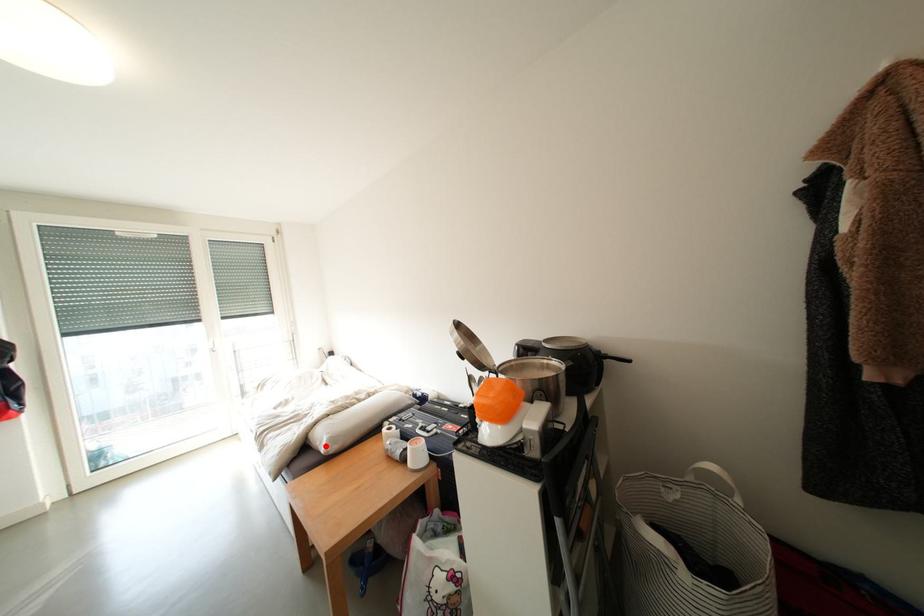
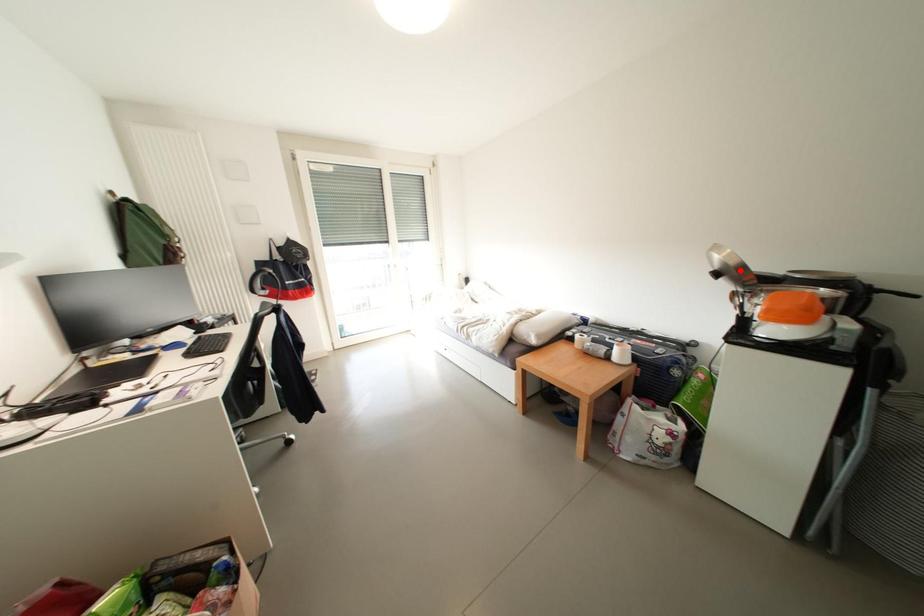
From the picture: I am providing you with two images of the same scene from different viewpoints. A red point is marked on the first image and another point is marked on the second image. Is the marked point in image1 the same physical position as the marked point in image2?

No